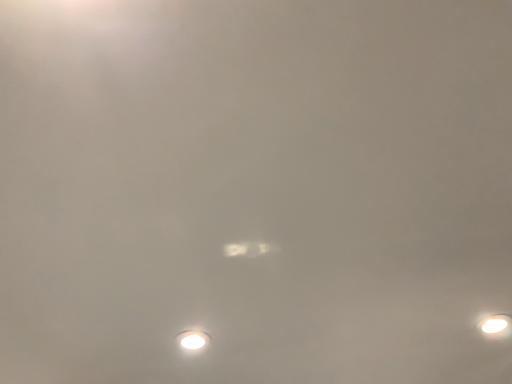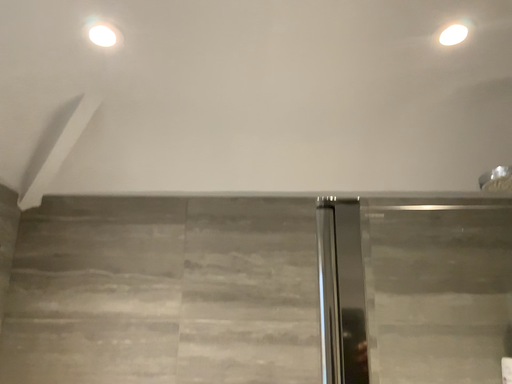
Question: How did the camera likely rotate when shooting the video?

Choices:
 (A) rotated upward
 (B) rotated downward

Answer: (B)